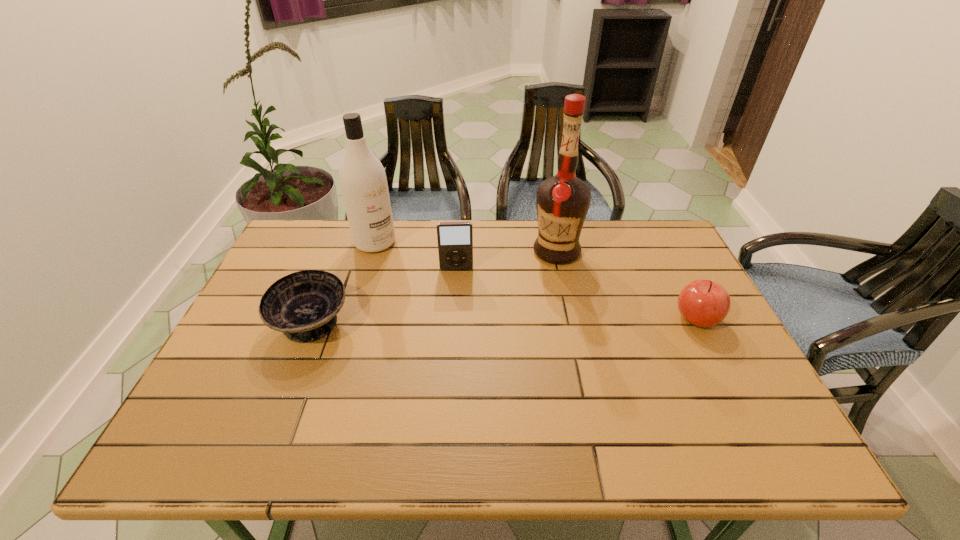
Where is `object that is at the left edge`? This screenshot has height=540, width=960. object that is at the left edge is located at coordinates (303, 305).

Identify the location of object positioned at the right edge. This screenshot has width=960, height=540. (704, 303).

The width and height of the screenshot is (960, 540). Identify the location of free space at the far edge of the desktop. (488, 253).

The width and height of the screenshot is (960, 540). In the image, there is a desktop. Find the location of `vacant space at the near edge`. vacant space at the near edge is located at coordinates (547, 409).

Locate an element on the screen. The width and height of the screenshot is (960, 540). blank space at the right edge of the desktop is located at coordinates (665, 293).

This screenshot has height=540, width=960. In the image, there is a desktop. In order to click on vacant space at the far right corner in this screenshot , I will do (656, 241).

The width and height of the screenshot is (960, 540). In order to click on empty location between the rightmost object and the bowl in this screenshot , I will do `click(504, 321)`.

Image resolution: width=960 pixels, height=540 pixels. What are the coordinates of `free space between the fourth shortest object and the bowl` in the screenshot? It's located at (344, 284).

At what (x,y) coordinates should I click in order to perform the action: click on free spot between the fourth tallest object and the liquor. Please return your answer as a coordinate pair (x, y). This screenshot has height=540, width=960. Looking at the image, I should click on (627, 285).

This screenshot has width=960, height=540. I want to click on unoccupied position between the fourth object from left to right and the apple, so click(x=627, y=285).